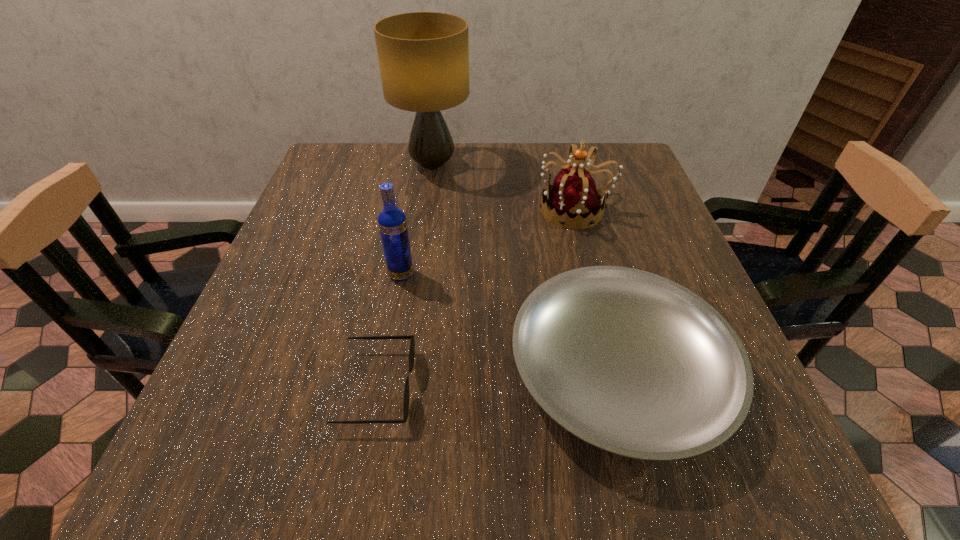
Locate an element on the screen. The height and width of the screenshot is (540, 960). object present at the near right corner is located at coordinates (633, 363).

Where is `vacant space at the left edge`? The width and height of the screenshot is (960, 540). vacant space at the left edge is located at coordinates (309, 228).

Identify the location of vacant space at the right edge. (654, 224).

Where is `vacant space that is in between the vodka and the sunglasses`? The image size is (960, 540). vacant space that is in between the vodka and the sunglasses is located at coordinates (389, 331).

Find the location of a particular element. vacant space that is in between the bedpan and the vodka is located at coordinates (510, 323).

I want to click on vacant area that lies between the sunglasses and the third shortest object, so pyautogui.click(x=476, y=298).

What are the coordinates of `free point between the third farthest object and the sunglasses` in the screenshot? It's located at (389, 331).

The width and height of the screenshot is (960, 540). I want to click on free space that is in between the shortest object and the tiara, so click(x=476, y=298).

Locate an element on the screen. unoccupied position between the farthest object and the vodka is located at coordinates (417, 220).

Identify the location of vacant point located between the lampshade and the bedpan. This screenshot has height=540, width=960. (525, 268).